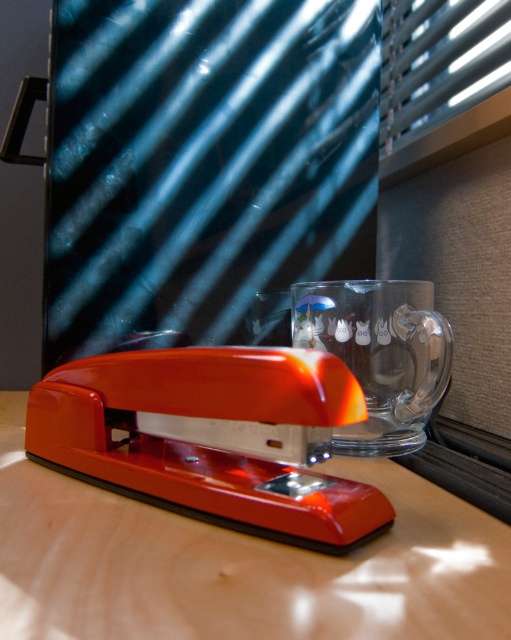
Who is positioned more to the right, glossy wood stapler at lower left or transparent glass at center?

From the viewer's perspective, transparent glass at center appears more on the right side.

Is point (131, 540) more distant than point (429, 301)?

No, it is not.

Locate an element on the screen. This screenshot has height=640, width=511. glossy wood stapler at lower left is located at coordinates click(238, 564).

Identify the location of glossy wood stapler at lower left. This screenshot has height=640, width=511. (238, 564).

Is glossy wood stapler at lower left wider than glossy plastic stapler at center?

Yes, glossy wood stapler at lower left is wider than glossy plastic stapler at center.

This screenshot has height=640, width=511. What do you see at coordinates (238, 564) in the screenshot? I see `glossy wood stapler at lower left` at bounding box center [238, 564].

Locate an element on the screen. glossy wood stapler at lower left is located at coordinates (238, 564).

Does point (260, 452) lie behind point (437, 342)?

No, (260, 452) is in front of (437, 342).

You are a GUI agent. You are given a task and a screenshot of the screen. Output one action in this format:
    pyautogui.click(x=<x>, y=<y>)
    Task: Click on the glossy plastic stapler at center
    
    Given the screenshot: What is the action you would take?
    pyautogui.click(x=213, y=436)